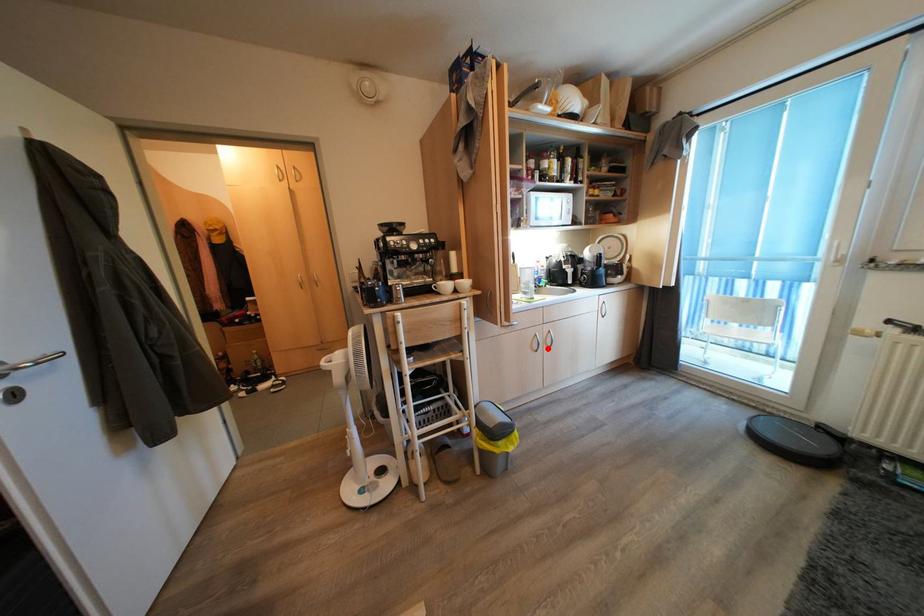
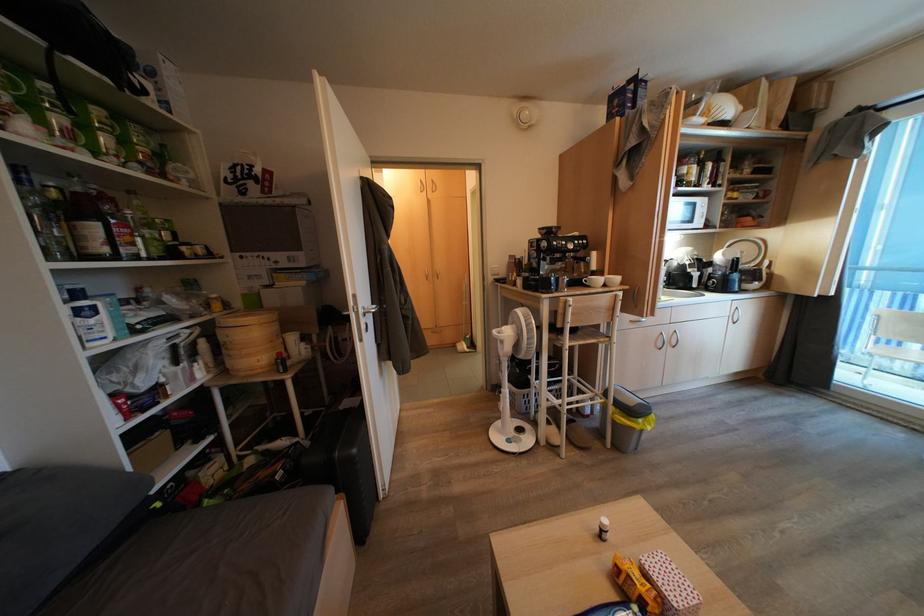
Find the pixel in the second image that matches the highlighted location in the first image.

(672, 347)